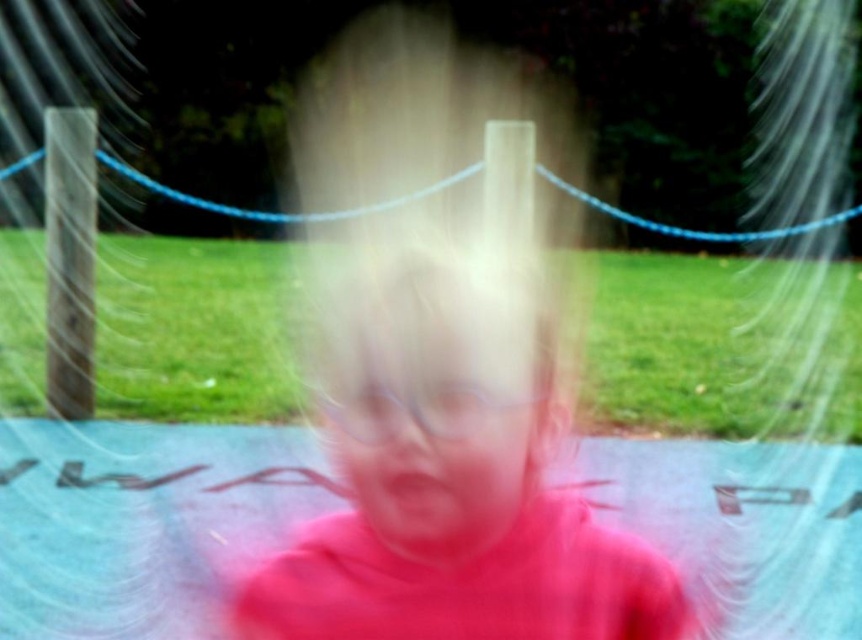
You are a photographer who just took a blurry photo of a child in a park. You want to know where the point at coordinates (453, 445) is located. Based on the image, can you determine which object this point is on?

The point at coordinates (453, 445) is on the pink matte shirt at center.

You are a photographer trying to focus on the child in the image. Which part of the child, the pink matte shirt at center or the pink matte face at center, would be easier to capture in a clear photo due to its size?

The pink matte shirt at center would be easier to capture in a clear photo because its width is larger than the pink matte face at center.

You are a photographer reviewing a motion blurred image. You see the pink matte shirt at center and the pink matte face at center. Which object in the image appears larger?

The pink matte shirt at center appears larger than the pink matte face at center because the pink matte shirt at center is bigger than pink matte face at center.